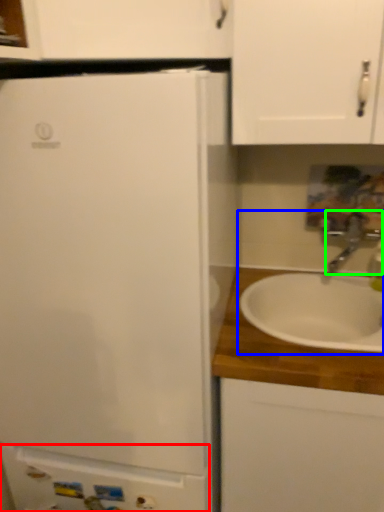
Question: Considering the real-world distances, which object is farthest from cabinetry (highlighted by a red box)? sink (highlighted by a blue box) or tap (highlighted by a green box)?

Choices:
 (A) sink
 (B) tap

Answer: (B)